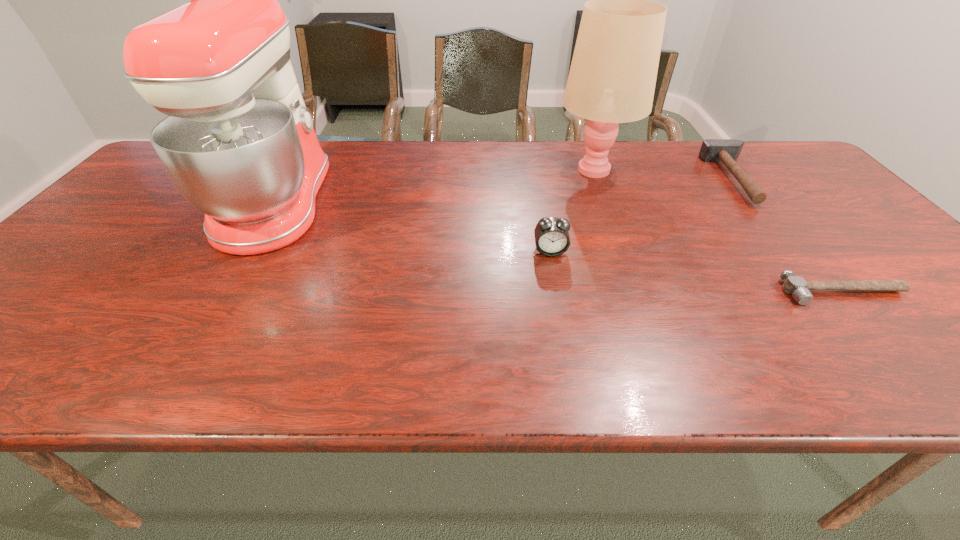
At what (x,y) coordinates should I click in order to perform the action: click on blank space located 0.290m on the front side of the alarm clock. Please return your answer as a coordinate pair (x, y). This screenshot has width=960, height=540. Looking at the image, I should click on (569, 360).

Locate an element on the screen. This screenshot has height=540, width=960. vacant space located on the striking surface of the fourth tallest object is located at coordinates (641, 178).

Locate an element on the screen. vacant space located on the striking surface of the fourth tallest object is located at coordinates [675, 178].

Identify the location of vacant space situated on the striking surface of the fourth tallest object. The height and width of the screenshot is (540, 960). (682, 178).

Image resolution: width=960 pixels, height=540 pixels. Identify the location of free spot located 0.080m on the striking face of the nearest object. (879, 335).

Identify the location of mixer that is positioned at the far edge. (239, 145).

Image resolution: width=960 pixels, height=540 pixels. In order to click on lampshade that is positioned at the far edge in this screenshot , I will do (x=612, y=78).

Locate an element on the screen. Image resolution: width=960 pixels, height=540 pixels. hammer that is at the far edge is located at coordinates (727, 151).

You are a GUI agent. You are given a task and a screenshot of the screen. Output one action in this format:
    pyautogui.click(x=<x>, y=<y>)
    Task: Click on the object that is at the right edge
    
    Given the screenshot: What is the action you would take?
    pyautogui.click(x=797, y=286)

In the image, there is a desktop. Where is `vacant space at the far edge`? vacant space at the far edge is located at coordinates [x=681, y=141].